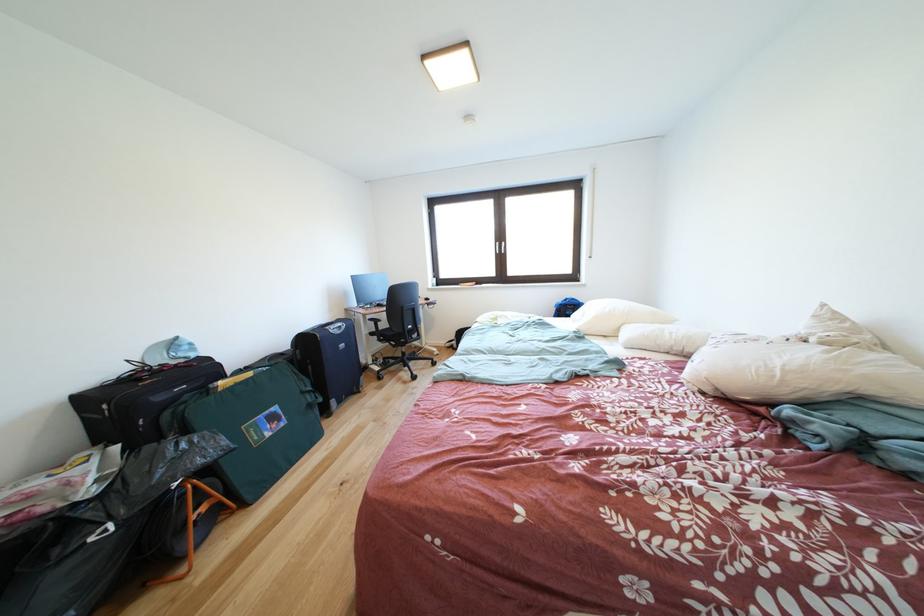
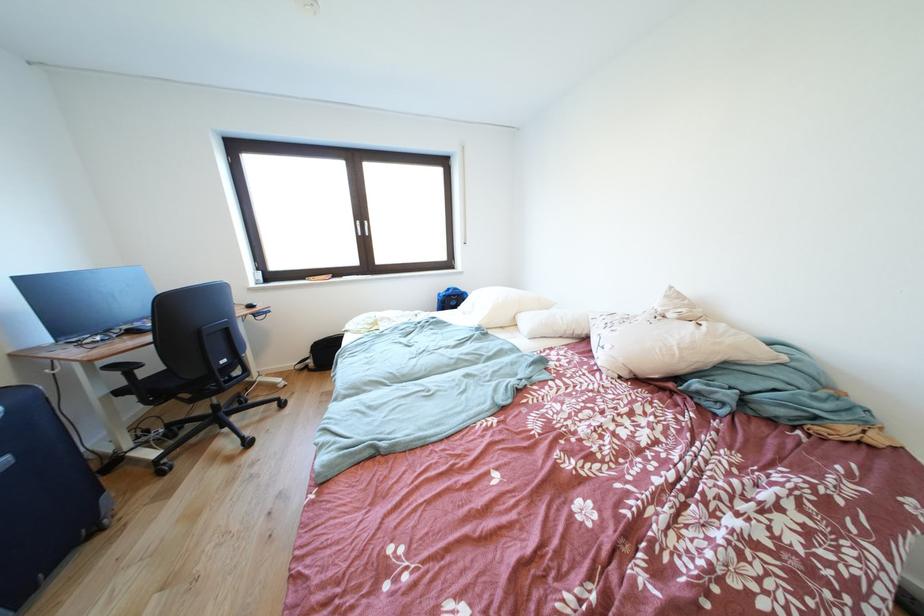
Where in the second image is the point corresponding to (x=460, y=351) from the first image?

(315, 371)